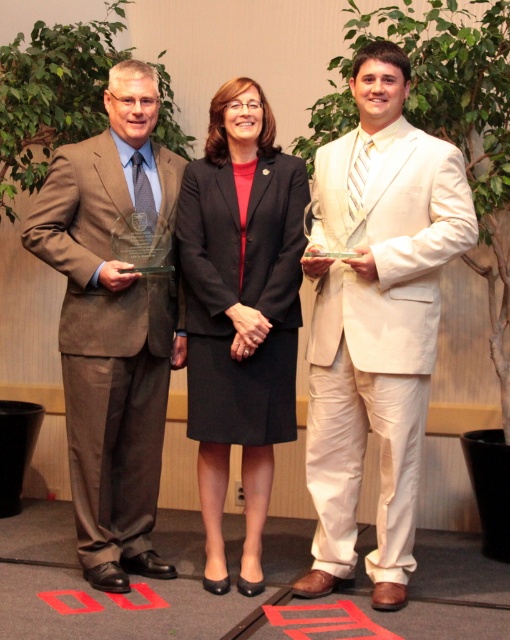
Question: Considering the real-world distances, which object is closest to the matte brown suit at left?

Choices:
 (A) black fabric skirt at center
 (B) white satin suit at center

Answer: (A)

Question: Does white satin suit at center have a greater width compared to black fabric skirt at center?

Choices:
 (A) no
 (B) yes

Answer: (B)

Question: Does matte brown suit at left have a greater width compared to black fabric skirt at center?

Choices:
 (A) yes
 (B) no

Answer: (A)

Question: Which point appears closest to the camera in this image?

Choices:
 (A) (59, 211)
 (B) (191, 204)
 (C) (376, 275)

Answer: (C)

Question: Does matte brown suit at left appear over black fabric skirt at center?

Choices:
 (A) no
 (B) yes

Answer: (B)

Question: Which point appears closest to the camera in this image?

Choices:
 (A) (258, 465)
 (B) (397, 394)

Answer: (B)